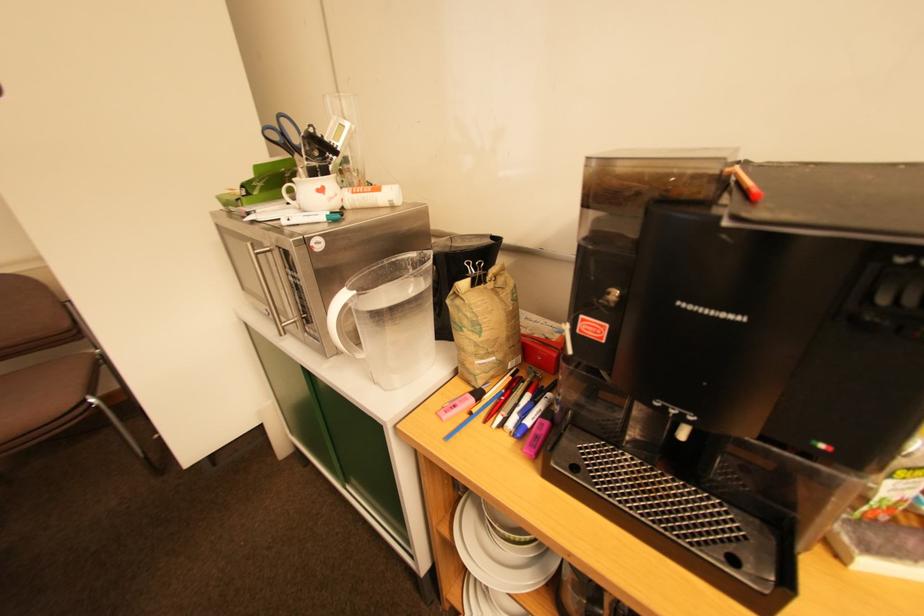
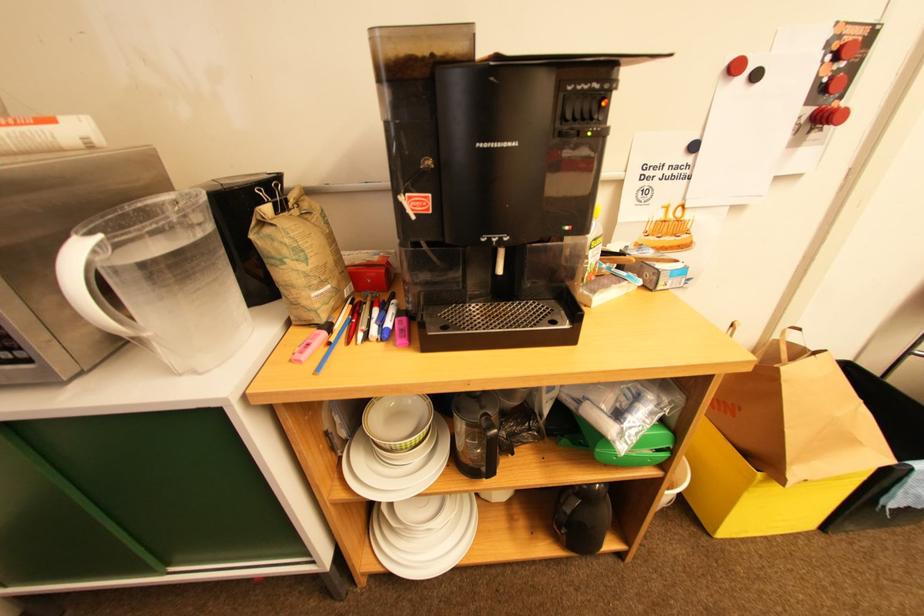
Question: The images are taken continuously from a first-person perspective. In which direction is your viewpoint rotating?

Choices:
 (A) Left
 (B) Right
 (C) Up
 (D) Down

Answer: (B)